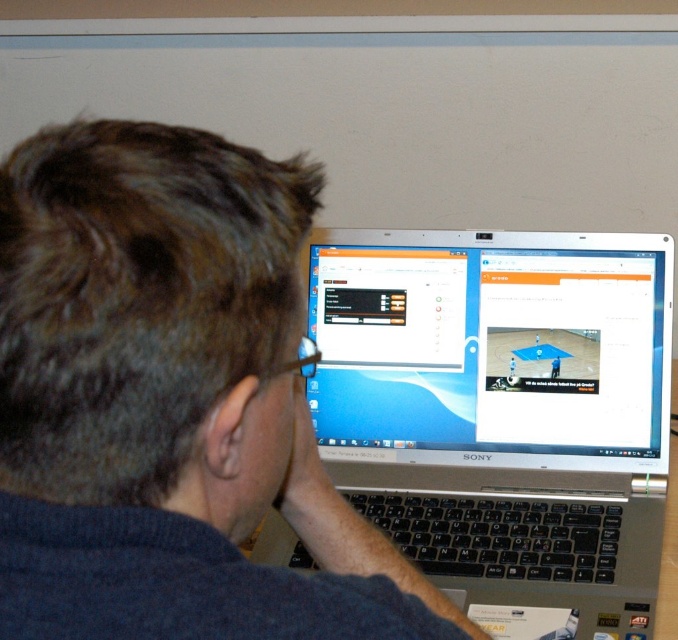
Question: Among these points, which one is nearest to the camera?

Choices:
 (A) 319,474
 (B) 620,573

Answer: (A)

Question: Can you confirm if dark blue sweater at center is thinner than silver metallic laptop at center?

Choices:
 (A) yes
 (B) no

Answer: (A)

Question: Which of the following is the closest to the observer?

Choices:
 (A) (664, 392)
 (B) (226, 141)

Answer: (A)

Question: Can you confirm if dark blue sweater at center is positioned below silver metallic laptop at center?

Choices:
 (A) no
 (B) yes

Answer: (A)

Question: Does dark blue sweater at center have a lesser width compared to silver metallic laptop at center?

Choices:
 (A) no
 (B) yes

Answer: (B)

Question: Which object appears closest to the camera in this image?

Choices:
 (A) silver metallic laptop at center
 (B) dark blue sweater at center

Answer: (B)